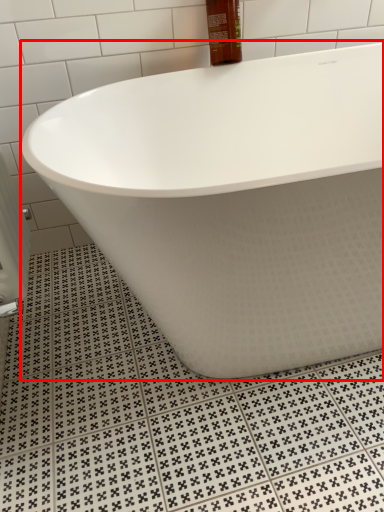
Question: From the image's perspective, considering the relative positions of bathtub (annotated by the red box) and mouthwash in the image provided, where is bathtub (annotated by the red box) located with respect to the staircase?

Choices:
 (A) above
 (B) below

Answer: (B)